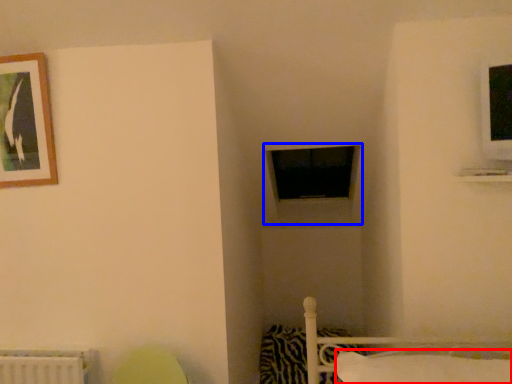
Question: Which of the following is the farthest to the observer, pillow (highlighted by a red box) or window frame (highlighted by a blue box)?

Choices:
 (A) pillow
 (B) window frame

Answer: (B)